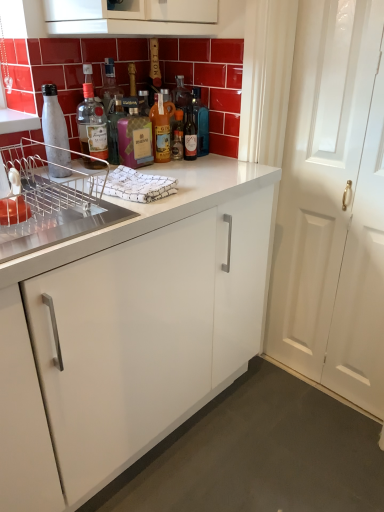
Question: Are pink glass bottle at center, the 3th bottle positioned from the left, and translucent glass bottle at center, the fifth bottle in the left-to-right sequence, far apart?

Choices:
 (A) no
 (B) yes

Answer: (A)

Question: Is translucent glass bottle at center, the fifth bottle in the left-to-right sequence, at the back of pink glass bottle at center, the 3th bottle positioned from the left?

Choices:
 (A) yes
 (B) no

Answer: (B)

Question: Considering the relative positions of pink glass bottle at center, the 3th bottle positioned from the left, and translucent glass bottle at center, arranged as the 2th bottle when viewed from the right, in the image provided, is pink glass bottle at center, the 3th bottle positioned from the left, to the right of translucent glass bottle at center, arranged as the 2th bottle when viewed from the right, from the viewer's perspective?

Choices:
 (A) yes
 (B) no

Answer: (B)

Question: Is pink glass bottle at center, the fourth bottle from the right, wider than translucent glass bottle at center, the fifth bottle in the left-to-right sequence?

Choices:
 (A) yes
 (B) no

Answer: (A)

Question: Is pink glass bottle at center, the fourth bottle from the right, next to translucent glass bottle at center, the fifth bottle in the left-to-right sequence?

Choices:
 (A) no
 (B) yes

Answer: (A)

Question: Considering the relative sizes of pink glass bottle at center, the fourth bottle from the right, and translucent glass bottle at center, the fifth bottle in the left-to-right sequence, in the image provided, is pink glass bottle at center, the fourth bottle from the right, taller than translucent glass bottle at center, the fifth bottle in the left-to-right sequence,?

Choices:
 (A) no
 (B) yes

Answer: (B)

Question: Does pink glass bottle at center, the 3th bottle positioned from the left, have a smaller size compared to white matte water bottle at left, which is the first bottle from left to right?

Choices:
 (A) no
 (B) yes

Answer: (A)

Question: From a real-world perspective, is pink glass bottle at center, the 3th bottle positioned from the left, physically below white matte water bottle at left, which is the 6th bottle from right to left?

Choices:
 (A) yes
 (B) no

Answer: (A)

Question: From the image's perspective, is pink glass bottle at center, the fourth bottle from the right, on white matte water bottle at left, which is the 6th bottle from right to left?

Choices:
 (A) no
 (B) yes

Answer: (B)

Question: Is pink glass bottle at center, the fourth bottle from the right, bigger than white matte water bottle at left, which is the first bottle from left to right?

Choices:
 (A) no
 (B) yes

Answer: (B)

Question: Is pink glass bottle at center, the 3th bottle positioned from the left, positioned with its back to white matte water bottle at left, which is the first bottle from left to right?

Choices:
 (A) no
 (B) yes

Answer: (A)

Question: Is pink glass bottle at center, the 3th bottle positioned from the left, thinner than white matte water bottle at left, which is the first bottle from left to right?

Choices:
 (A) no
 (B) yes

Answer: (A)

Question: Could you tell me if pink glass bottle at center, the 3th bottle positioned from the left, is turned towards matte glass bottle at upper center, which is the fifth bottle in right-to-left order?

Choices:
 (A) yes
 (B) no

Answer: (B)